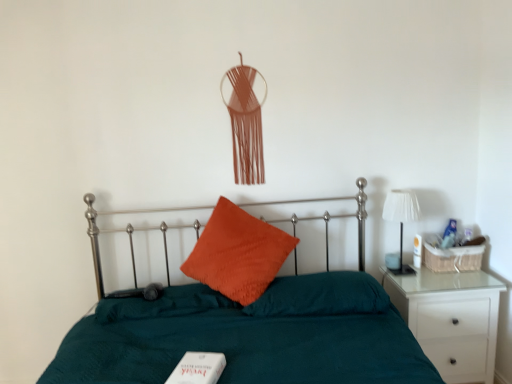
Question: Would you say orange velvet pillow at center, which is the first pillow from right to left, is to the left or to the right of teal fabric bed at center in the picture?

Choices:
 (A) left
 (B) right

Answer: (B)

Question: Considering the positions of orange velvet pillow at center, which is the first pillow from right to left, and teal fabric bed at center in the image, is orange velvet pillow at center, which is the first pillow from right to left, wider or thinner than teal fabric bed at center?

Choices:
 (A) thin
 (B) wide

Answer: (A)

Question: Considering the real-world distances, which object is farthest from the teal fabric bed at center?

Choices:
 (A) orange cotton pillow at center, the 2th pillow viewed from the right
 (B) white matte book at lower center
 (C) white glossy nightstand at right
 (D) orange velvet pillow at center, the 2th pillow from the left
 (E) white fabric lampshade at right

Answer: (E)

Question: Which is nearer to the orange velvet pillow at center, the 2th pillow from the left?

Choices:
 (A) orange cotton pillow at center, the 2th pillow viewed from the right
 (B) teal fabric bed at center
 (C) white matte book at lower center
 (D) white fabric lampshade at right
 (E) white glossy nightstand at right

Answer: (B)